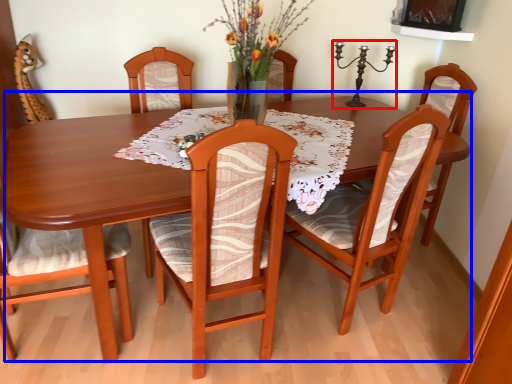
Question: Among these objects, which one is nearest to the camera, candle holder (highlighted by a red box) or kitchen & dining room table (highlighted by a blue box)?

Choices:
 (A) candle holder
 (B) kitchen & dining room table

Answer: (B)